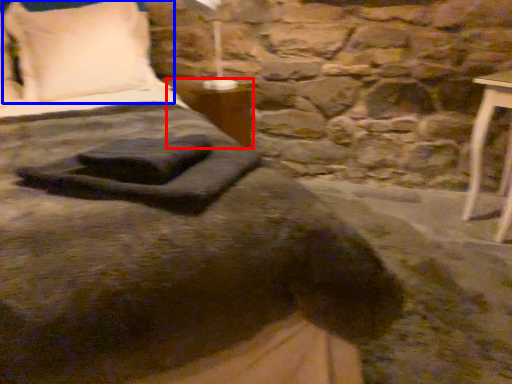
Question: Which point is closer to the camera, table (highlighted by a red box) or pillow (highlighted by a blue box)?

Choices:
 (A) table
 (B) pillow

Answer: (B)